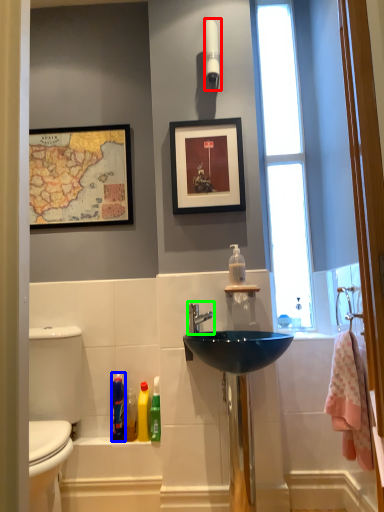
Question: Which is farther away from light fixture (highlighted by a red box)? cleaning product (highlighted by a blue box) or tap (highlighted by a green box)?

Choices:
 (A) cleaning product
 (B) tap

Answer: (A)